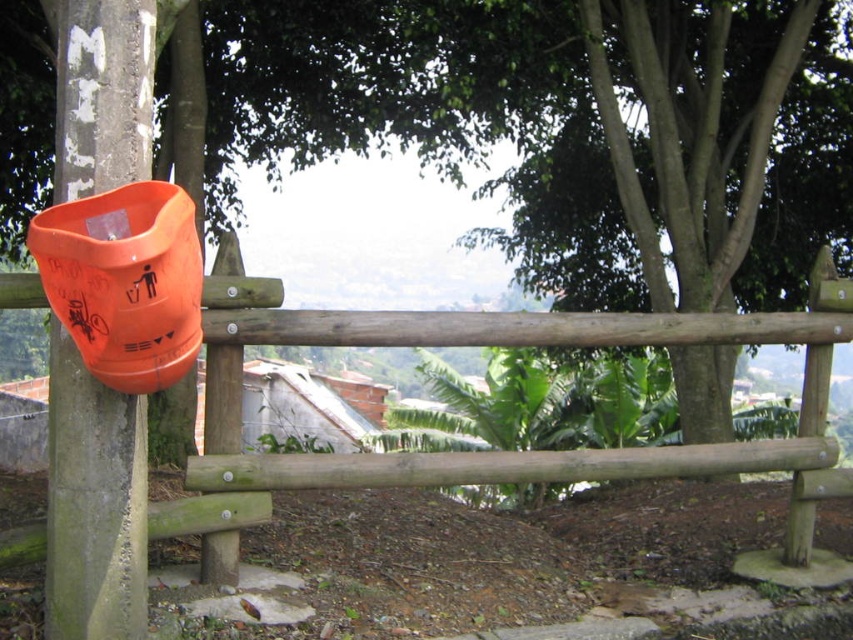
You are a painter standing at the base of the wooden fence at center. You want to paint the orange matte plastic trash can at left but need to know if you can reach it without a ladder. Given that the trash can is mounted on a fence post, can you determine if the trash can is within your reach?

The wooden fence at center has a greater height compared to orange matte plastic trash can at left. Since the trash can is mounted on a fence post that is shorter than the fence itself, it is likely within reach without a ladder.

You are standing at point A and want to place a new fence post exactly at point B, which is located at coordinates (387, 452). According to the scene description, what object is already present at that location?

The wooden fence at center is already present at point B, so placing a new fence post there would interfere with the existing structure.